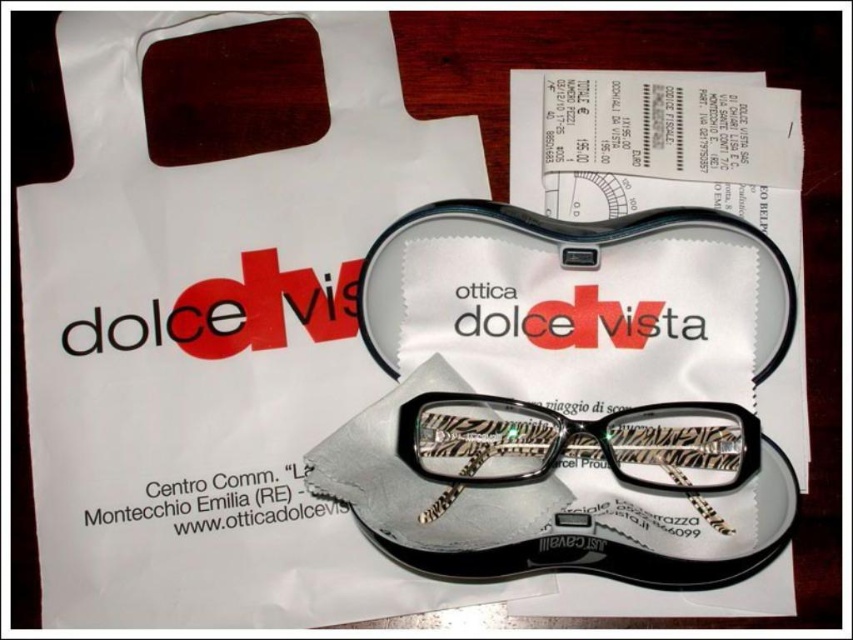
Can you confirm if black matte eyewear case at center is shorter than black matte eyeglass case at center?

No, black matte eyewear case at center is not shorter than black matte eyeglass case at center.

Between point (357, 492) and point (386, 342), which one is positioned behind?

Point (386, 342)

The image size is (853, 640). What are the coordinates of `black matte eyewear case at center` in the screenshot? It's located at (569, 396).

Which is more to the right, zebra-patterned plastic glasses at center or black matte eyeglass case at center?

black matte eyeglass case at center is more to the right.

Which of these two, zebra-patterned plastic glasses at center or black matte eyeglass case at center, stands shorter?

Standing shorter between the two is zebra-patterned plastic glasses at center.

Between point (637, 422) and point (776, 266), which one is positioned behind?

Positioned behind is point (637, 422).

Where is `zebra-patterned plastic glasses at center`? zebra-patterned plastic glasses at center is located at coordinates (578, 442).

Does black matte eyewear case at center have a smaller size compared to zebra-patterned plastic glasses at center?

Actually, black matte eyewear case at center might be larger than zebra-patterned plastic glasses at center.

Between point (602, 497) and point (428, 461), which one is positioned in front?

Point (602, 497) is more forward.

This screenshot has width=853, height=640. What do you see at coordinates (569, 396) in the screenshot?
I see `black matte eyewear case at center` at bounding box center [569, 396].

At what (x,y) coordinates should I click in order to perform the action: click on black matte eyewear case at center. Please return your answer as a coordinate pair (x, y). This screenshot has height=640, width=853. Looking at the image, I should click on (569, 396).